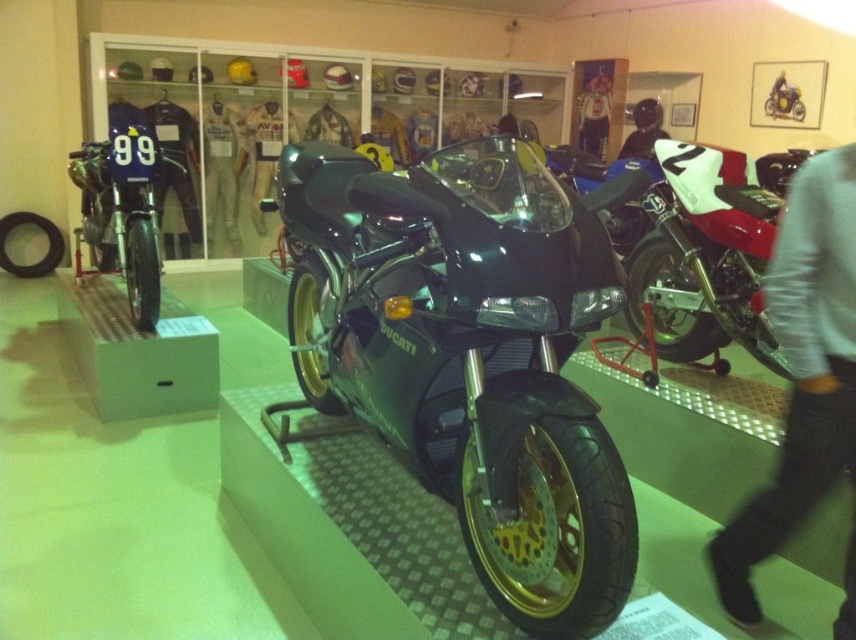
In the scene shown: You are an interior designer planning to place a large sculpture in the museum exhibit. You need to ensure it doesn not block the view of the shiny metallic racing bike at left and the gray sweater at upper right. Given their sizes, which object requires more space to accommodate the sculpture without obstruction?

The shiny metallic racing bike at left requires more space because it is larger than the gray sweater at upper right, so placing the sculpture near it would need more room to avoid blocking the view.